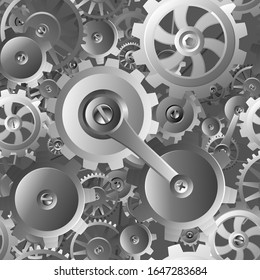
The image size is (260, 280). What are the coordinates of `screws` in the screenshot? It's located at (45, 196), (181, 185), (175, 117), (103, 113), (208, 124), (237, 110), (117, 182), (10, 121).